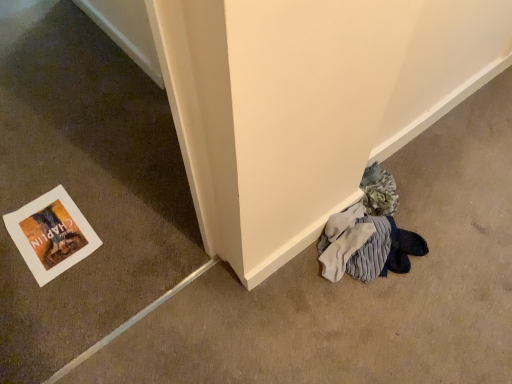
Question: Is the position of white paper at lower left more distant than that of white paper at lower left?

Choices:
 (A) yes
 (B) no

Answer: (B)

Question: From the image's perspective, is white paper at lower left over white paper at lower left?

Choices:
 (A) yes
 (B) no

Answer: (B)

Question: From a real-world perspective, is white paper at lower left on white paper at lower left?

Choices:
 (A) no
 (B) yes

Answer: (B)

Question: Does white paper at lower left have a larger size compared to white paper at lower left?

Choices:
 (A) yes
 (B) no

Answer: (A)

Question: Are white paper at lower left and white paper at lower left making contact?

Choices:
 (A) no
 (B) yes

Answer: (A)

Question: Can you confirm if white paper at lower left is smaller than white paper at lower left?

Choices:
 (A) yes
 (B) no

Answer: (B)

Question: Does white paper at lower left turn towards white paper at lower left?

Choices:
 (A) no
 (B) yes

Answer: (B)

Question: Can you confirm if white paper at lower left is thinner than white paper at lower left?

Choices:
 (A) no
 (B) yes

Answer: (A)

Question: Considering the relative sizes of white paper at lower left and white paper at lower left in the image provided, is white paper at lower left shorter than white paper at lower left?

Choices:
 (A) yes
 (B) no

Answer: (A)

Question: Is white paper at lower left behind white paper at lower left?

Choices:
 (A) yes
 (B) no

Answer: (A)

Question: Considering the relative positions of white paper at lower left and white paper at lower left in the image provided, is white paper at lower left in front of white paper at lower left?

Choices:
 (A) no
 (B) yes

Answer: (A)

Question: Can you confirm if white paper at lower left is wider than white paper at lower left?

Choices:
 (A) yes
 (B) no

Answer: (A)

Question: Which is correct: white paper at lower left is inside white paper at lower left, or outside of it?

Choices:
 (A) outside
 (B) inside

Answer: (A)